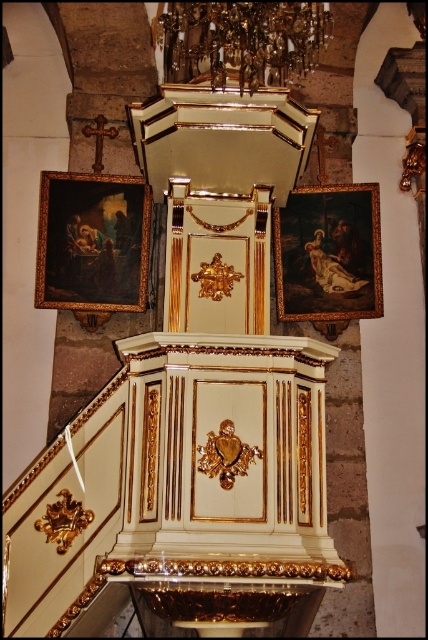
Question: Does oil painting at left lie in front of wooden dark painting at right?

Choices:
 (A) no
 (B) yes

Answer: (B)

Question: Among these objects, which one is farthest from the camera?

Choices:
 (A) oil painting at left
 (B) wooden dark painting at right

Answer: (B)

Question: Which object appears farthest from the camera in this image?

Choices:
 (A) oil painting at left
 (B) wooden dark painting at right

Answer: (B)

Question: Can you confirm if oil painting at left is wider than wooden dark painting at right?

Choices:
 (A) no
 (B) yes

Answer: (B)

Question: Can you confirm if oil painting at left is bigger than wooden dark painting at right?

Choices:
 (A) no
 (B) yes

Answer: (A)